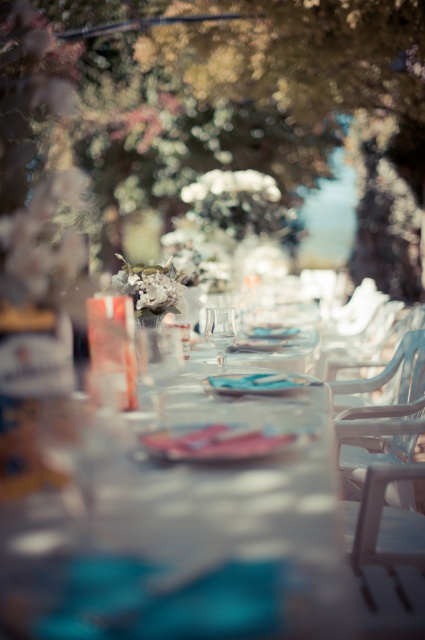
You are setting up a table for an event and need to place a white plastic chair at center and a clear glass wine glass at center. Which object has a greater width?

The white plastic chair at center has a greater width than the clear glass wine glass at center.

You are setting up for a wedding reception and need to place a decorative centerpiece between the white plastic chair at center and the clear glass wine glass at center. The centerpiece is 18 inches wide. Will it fit between them?

The white plastic chair at center and clear glass wine glass at center are 20.05 inches apart. Since the centerpiece is 18 inches wide, it will fit between them with a small gap remaining.

You are a photographer adjusting the lighting for a wedding photo. You need to ensure that the white plastic chair at center and the clear glass wine glass at center are both well lit. From the perspective of someone standing behind the table, which object should you move to the left to better position the light?

The white plastic chair at center is to the right of the clear glass wine glass at center. To better position the light, you should move the white plastic chair at center to the left so it aligns with or is positioned to the left of the clear glass wine glass at center.